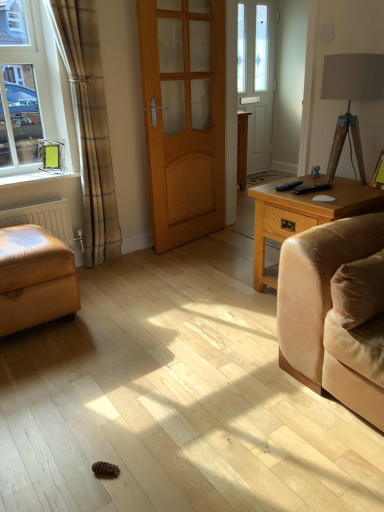
Question: Is suede cushion at right far from white matte radiator at lower left?

Choices:
 (A) yes
 (B) no

Answer: (A)

Question: Is suede cushion at right located outside white matte radiator at lower left?

Choices:
 (A) yes
 (B) no

Answer: (A)

Question: Is suede cushion at right to the right of white matte radiator at lower left from the viewer's perspective?

Choices:
 (A) no
 (B) yes

Answer: (B)

Question: Is the surface of suede cushion at right in direct contact with white matte radiator at lower left?

Choices:
 (A) yes
 (B) no

Answer: (B)

Question: Is suede cushion at right facing towards white matte radiator at lower left?

Choices:
 (A) yes
 (B) no

Answer: (B)

Question: In the image, is light brown wooden side table at right on the left side or the right side of white plastic window sill at left?

Choices:
 (A) right
 (B) left

Answer: (A)

Question: From their relative heights in the image, would you say light brown wooden side table at right is taller or shorter than white plastic window sill at left?

Choices:
 (A) short
 (B) tall

Answer: (B)

Question: Considering the positions of light brown wooden side table at right and white plastic window sill at left in the image, is light brown wooden side table at right wider or thinner than white plastic window sill at left?

Choices:
 (A) thin
 (B) wide

Answer: (B)

Question: Based on their sizes in the image, would you say light brown wooden side table at right is bigger or smaller than white plastic window sill at left?

Choices:
 (A) small
 (B) big

Answer: (B)

Question: In terms of height, does plaid fabric curtain at left look taller or shorter compared to matte gray lampshade at upper right?

Choices:
 (A) short
 (B) tall

Answer: (B)

Question: Is plaid fabric curtain at left to the left or to the right of matte gray lampshade at upper right in the image?

Choices:
 (A) right
 (B) left

Answer: (B)

Question: Considering the positions of point (97, 139) and point (380, 61), is point (97, 139) closer or farther from the camera than point (380, 61)?

Choices:
 (A) closer
 (B) farther

Answer: (B)

Question: In the image, is plaid fabric curtain at left positioned in front of or behind matte gray lampshade at upper right?

Choices:
 (A) front
 (B) behind

Answer: (B)

Question: In terms of width, does matte wood cabinet at center look wider or thinner when compared to leather armchair at left?

Choices:
 (A) wide
 (B) thin

Answer: (B)

Question: Is matte wood cabinet at center in front of or behind leather armchair at left in the image?

Choices:
 (A) behind
 (B) front

Answer: (A)